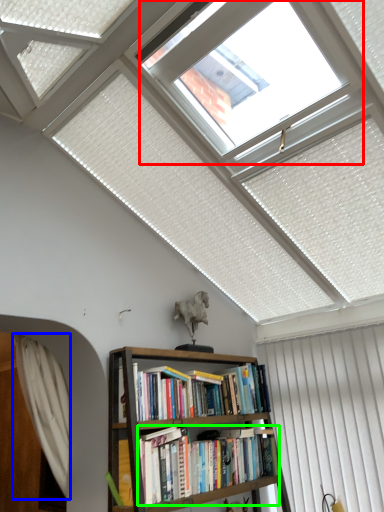
Question: Considering the real-world distances, which object is farthest from bay window (highlighted by a red box)? curtain (highlighted by a blue box) or book (highlighted by a green box)?

Choices:
 (A) curtain
 (B) book

Answer: (A)